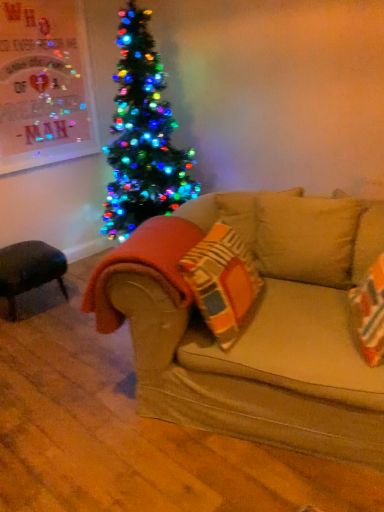
In order to click on orange fuzzy blanket at lower left in this screenshot , I will do `click(144, 266)`.

Image resolution: width=384 pixels, height=512 pixels. What are the coordinates of `orange fuzzy blanket at lower left` in the screenshot? It's located at click(144, 266).

Is orange fuzzy blanket at lower left turned away from black leather ottoman at lower left?

No, orange fuzzy blanket at lower left's orientation is not away from black leather ottoman at lower left.

Is orange fuzzy blanket at lower left placed right next to black leather ottoman at lower left?

No, orange fuzzy blanket at lower left is not making contact with black leather ottoman at lower left.

Considering the positions of objects orange fuzzy blanket at lower left and black leather ottoman at lower left in the image provided, who is behind, orange fuzzy blanket at lower left or black leather ottoman at lower left?

Positioned behind is black leather ottoman at lower left.

How much distance is there between beige fabric couch at center and orange fuzzy blanket at lower left?

beige fabric couch at center is 26.32 centimeters away from orange fuzzy blanket at lower left.

What are the coordinates of `studio couch below the orange fuzzy blanket at lower left (from the image's perspective)` in the screenshot? It's located at (255, 325).

Based on their sizes in the image, would you say beige fabric couch at center is bigger or smaller than orange fuzzy blanket at lower left?

beige fabric couch at center is bigger than orange fuzzy blanket at lower left.

Consider the image. From the image's perspective, relative to orange fuzzy blanket at lower left, is beige fabric couch at center above or below?

beige fabric couch at center is below orange fuzzy blanket at lower left.

Is point (263, 349) positioned behind point (38, 263)?

No.

From the image's perspective, would you say beige fabric couch at center is shown under black leather ottoman at lower left?

Indeed, from the image's perspective, beige fabric couch at center is shown beneath black leather ottoman at lower left.

How far apart are beige fabric couch at center and black leather ottoman at lower left?

A distance of 4.17 feet exists between beige fabric couch at center and black leather ottoman at lower left.

From a real-world perspective, is beige fabric couch at center physically located above or below black leather ottoman at lower left?

beige fabric couch at center is below black leather ottoman at lower left.

What's the angular difference between black leather ottoman at lower left and beige fabric couch at center's facing directions?

1.95 degrees.

Based on the photo, would you consider black leather ottoman at lower left to be distant from beige fabric couch at center?

Yes, black leather ottoman at lower left and beige fabric couch at center are quite far apart.

Is black leather ottoman at lower left smaller than beige fabric couch at center?

Yes, black leather ottoman at lower left is smaller than beige fabric couch at center.

Can you confirm if black leather ottoman at lower left is taller than orange fuzzy blanket at lower left?

No, black leather ottoman at lower left is not taller than orange fuzzy blanket at lower left.

In the scene shown: Is black leather ottoman at lower left not near orange fuzzy blanket at lower left?

Yes, black leather ottoman at lower left and orange fuzzy blanket at lower left are quite far apart.

Is orange fuzzy blanket at lower left at the back of black leather ottoman at lower left?

No.

Which object is wider, orange fuzzy blanket at lower left or beige fabric couch at center?

beige fabric couch at center is wider.

Consider the image. Could you tell me if orange fuzzy blanket at lower left is turned towards beige fabric couch at center?

No, orange fuzzy blanket at lower left is not turned towards beige fabric couch at center.

Are orange fuzzy blanket at lower left and beige fabric couch at center making contact?

No, orange fuzzy blanket at lower left is not in contact with beige fabric couch at center.

Between orange fuzzy blanket at lower left and beige fabric couch at center, which one has more height?

orange fuzzy blanket at lower left is taller.

This screenshot has height=512, width=384. Identify the location of blanket above the black leather ottoman at lower left (from the image's perspective). (144, 266).

Locate an element on the screen. This screenshot has height=512, width=384. studio couch below the orange fuzzy blanket at lower left (from the image's perspective) is located at coordinates (255, 325).

Looking at the image, which one is located further to black leather ottoman at lower left, orange fuzzy blanket at lower left or beige fabric couch at center?

beige fabric couch at center is further to black leather ottoman at lower left.

Estimate the real-world distances between objects in this image. Which object is further from orange fuzzy blanket at lower left, black leather ottoman at lower left or beige fabric couch at center?

black leather ottoman at lower left is positioned further to the anchor orange fuzzy blanket at lower left.

Estimate the real-world distances between objects in this image. Which object is further from black leather ottoman at lower left, beige fabric couch at center or orange fuzzy blanket at lower left?

The object further to black leather ottoman at lower left is beige fabric couch at center.

From the image, which object appears to be nearer to beige fabric couch at center, orange fuzzy blanket at lower left or black leather ottoman at lower left?

Among the two, orange fuzzy blanket at lower left is located nearer to beige fabric couch at center.

Based on their spatial positions, is beige fabric couch at center or black leather ottoman at lower left further from orange fuzzy blanket at lower left?

black leather ottoman at lower left.

From the image, which object appears to be farther from beige fabric couch at center, black leather ottoman at lower left or orange fuzzy blanket at lower left?

black leather ottoman at lower left.

Identify the location of blanket between beige fabric couch at center and black leather ottoman at lower left along the z-axis. Image resolution: width=384 pixels, height=512 pixels. (144, 266).